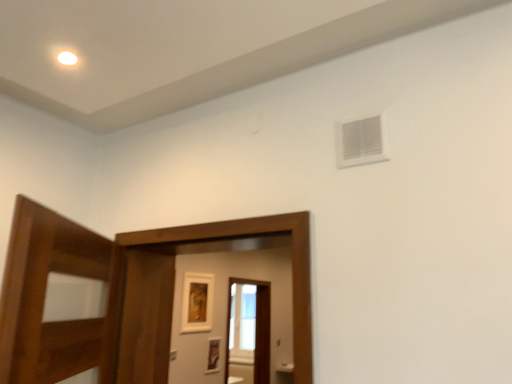
Question: Does matte gold picture frame at center, the 1th picture frame from the top, turn towards brown wooden screen door at center, the second screen door from the bottom?

Choices:
 (A) yes
 (B) no

Answer: (B)

Question: Is matte gold picture frame at center, which is the second picture frame in bottom-to-top order, further to the viewer compared to brown wooden screen door at center, acting as the first screen door starting from the front?

Choices:
 (A) yes
 (B) no

Answer: (A)

Question: From a real-world perspective, is matte gold picture frame at center, the 1th picture frame from the top, on top of brown wooden screen door at center, placed as the first screen door when sorted from top to bottom?

Choices:
 (A) no
 (B) yes

Answer: (B)

Question: From the image's perspective, is matte gold picture frame at center, which is the second picture frame in bottom-to-top order, under brown wooden screen door at center, acting as the first screen door starting from the front?

Choices:
 (A) yes
 (B) no

Answer: (A)

Question: Can you confirm if matte gold picture frame at center, which is the second picture frame in bottom-to-top order, is wider than brown wooden screen door at center, arranged as the second screen door when viewed from the back?

Choices:
 (A) yes
 (B) no

Answer: (B)

Question: Considering the relative positions of matte gold picture frame at center, which is the second picture frame in bottom-to-top order, and brown wooden screen door at center, the second screen door from the bottom, in the image provided, is matte gold picture frame at center, which is the second picture frame in bottom-to-top order, to the right of brown wooden screen door at center, the second screen door from the bottom, from the viewer's perspective?

Choices:
 (A) yes
 (B) no

Answer: (B)

Question: Does matte gold picture frame at center, which is the second picture frame in bottom-to-top order, have a greater width compared to transparent glass screen door at center, the first screen door when ordered from bottom to top?

Choices:
 (A) no
 (B) yes

Answer: (A)

Question: Does matte gold picture frame at center, the 1th picture frame from the top, contain transparent glass screen door at center, the first screen door when ordered from bottom to top?

Choices:
 (A) yes
 (B) no

Answer: (B)

Question: Considering the relative sizes of matte gold picture frame at center, the 1th picture frame from the top, and transparent glass screen door at center, the second screen door from the top, in the image provided, is matte gold picture frame at center, the 1th picture frame from the top, smaller than transparent glass screen door at center, the second screen door from the top,?

Choices:
 (A) no
 (B) yes

Answer: (B)

Question: Does matte gold picture frame at center, which is the second picture frame in bottom-to-top order, turn towards transparent glass screen door at center, which is the 1th screen door from back to front?

Choices:
 (A) yes
 (B) no

Answer: (B)

Question: From the image's perspective, does matte gold picture frame at center, which is the second picture frame in bottom-to-top order, appear lower than transparent glass screen door at center, the second screen door from the top?

Choices:
 (A) yes
 (B) no

Answer: (B)

Question: Can you confirm if matte gold picture frame at center, the 1th picture frame from the top, is shorter than transparent glass screen door at center, the first screen door when ordered from bottom to top?

Choices:
 (A) yes
 (B) no

Answer: (A)

Question: Is transparent glass screen door at center, arranged as the 2th screen door when viewed from the front, looking in the opposite direction of white plastic vent at upper right?

Choices:
 (A) yes
 (B) no

Answer: (B)